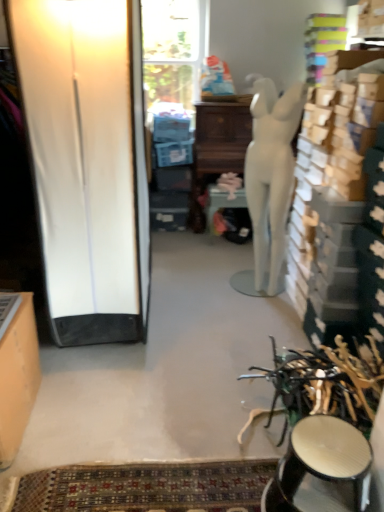
Identify the location of vacant space situated on the left part of white matte mannequin at center. The width and height of the screenshot is (384, 512). (218, 294).